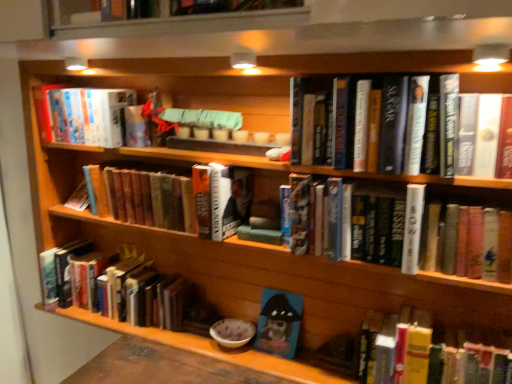
Question: Would you say hardcover book at lower left, the 2th book positioned from the bottom, is inside or outside hardcover book at center, the second book in the top-to-bottom sequence?

Choices:
 (A) inside
 (B) outside

Answer: (B)

Question: In terms of size, does hardcover book at lower left, the 2th book positioned from the bottom, appear bigger or smaller than hardcover book at center, positioned as the 5th book in bottom-to-top order?

Choices:
 (A) small
 (B) big

Answer: (B)

Question: Estimate the real-world distances between objects in this image. Which object is closer to the hardcover book at center, the second book in the top-to-bottom sequence?

Choices:
 (A) hardcover book at lower left, the 5th book positioned from the top
 (B) hardcover books at upper left, positioned as the 6th book in bottom-to-top order
 (C) blue textured canvas at center, which ranks as the first book in bottom-to-top order
 (D) hardcover book at center, positioned as the 4th book in bottom-to-top order
 (E) hardcover book at center, the 4th book from the top

Answer: (E)

Question: Which object is the closest to the hardcover book at lower left, the 2th book positioned from the bottom?

Choices:
 (A) hardcover book at center, positioned as the 4th book in bottom-to-top order
 (B) hardcover book at center, which is the 3th book from bottom to top
 (C) hardcover books at upper left, positioned as the 6th book in bottom-to-top order
 (D) blue textured canvas at center, arranged as the sixth book when viewed from the top
 (E) hardcover book at center, the second book in the top-to-bottom sequence

Answer: (A)